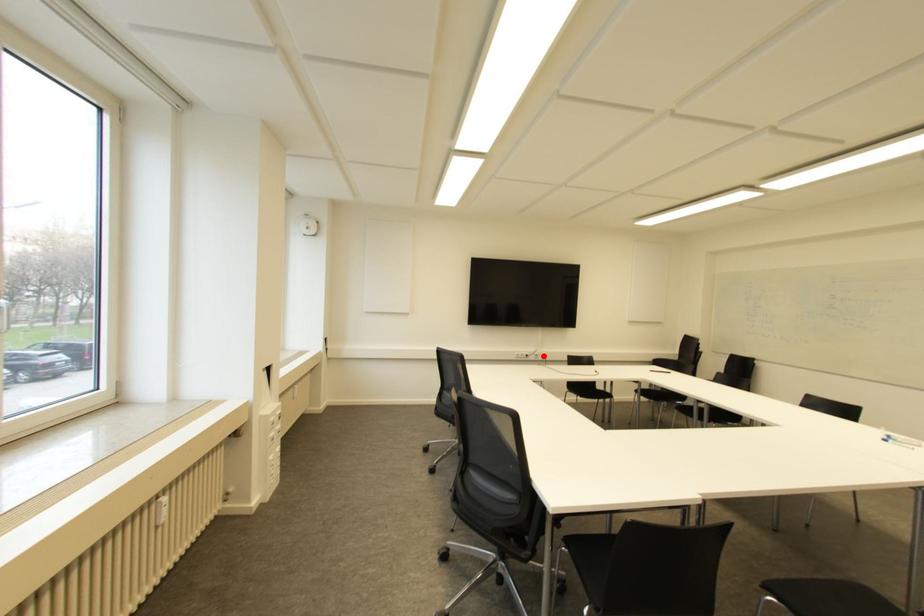
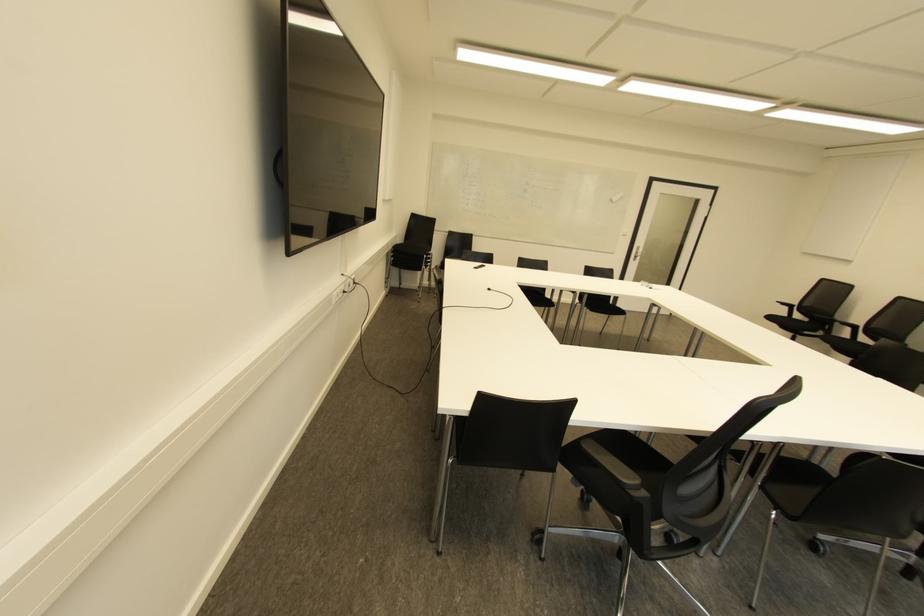
Question: I am providing you with two images of the same scene from different viewpoints. Image1 has a red point marked. In image2, the corresponding 3D location appears at what relative position? Reply with the corresponding letter.

Choices:
 (A) Closer
 (B) Farther

Answer: (A)